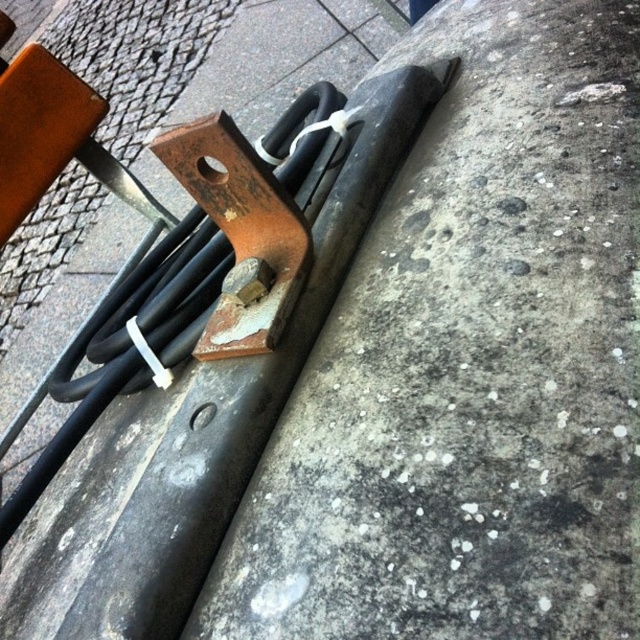
You are a delivery robot trying to navigate through an outdoor area. You need to move from the gray concrete at center to the rusty metal curb at center. Which surface will you have to maneuver over first?

The gray concrete at center has a smaller size compared to the rusty metal curb at center, so you will first maneuver over the gray concrete at center before reaching the rusty metal curb at center.

You are standing on the gray concrete at center and want to move to the rusty metal curb at center. Which direction should you walk to reach it?

Since the gray concrete at center is to the right of the rusty metal curb at center, you should walk to the left to reach the curb.

You are a photographer adjusting your camera settings to focus on two points in the scene. The first point is at coordinates point (604, 80) and the second is at point (269, 296). Which point should you focus on first to ensure both are in sharp focus?

You should focus on point (604, 80) first because it is closer to the camera than point (269, 296), allowing the camera to adjust the depth of field to include both points.